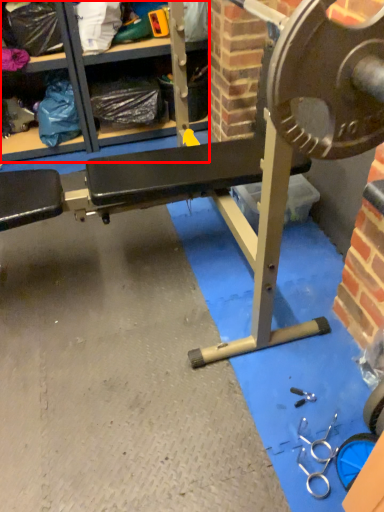
Question: Considering the relative positions of shelf (annotated by the red box) and bench in the image provided, where is shelf (annotated by the red box) located with respect to the staircase?

Choices:
 (A) right
 (B) left

Answer: (B)